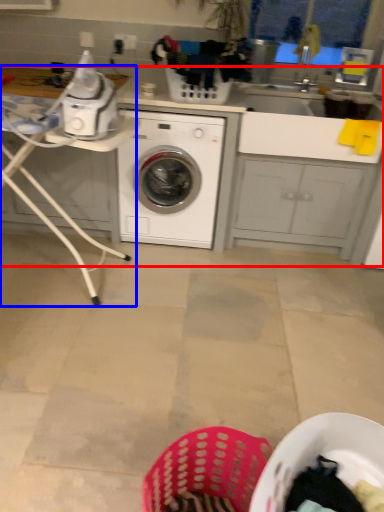
Question: Among these objects, which one is nearest to the camera, counter top (highlighted by a red box) or table (highlighted by a blue box)?

Choices:
 (A) counter top
 (B) table

Answer: (B)